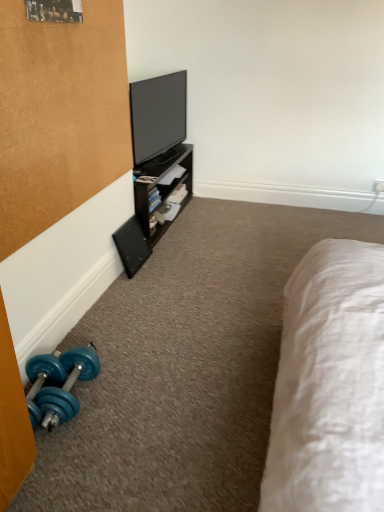
Question: Could you tell me if black matte speaker at lower left is turned towards flat screen tv at upper center?

Choices:
 (A) yes
 (B) no

Answer: (B)

Question: Does black matte speaker at lower left have a lesser width compared to flat screen tv at upper center?

Choices:
 (A) no
 (B) yes

Answer: (B)

Question: Does black matte speaker at lower left have a larger size compared to flat screen tv at upper center?

Choices:
 (A) no
 (B) yes

Answer: (A)

Question: From the image's perspective, is black matte speaker at lower left beneath flat screen tv at upper center?

Choices:
 (A) no
 (B) yes

Answer: (B)

Question: Is black matte speaker at lower left shorter than flat screen tv at upper center?

Choices:
 (A) yes
 (B) no

Answer: (A)

Question: Looking at the image, does blue rubber dumbbell at lower left seem bigger or smaller compared to black matte speaker at lower left?

Choices:
 (A) small
 (B) big

Answer: (B)

Question: In the image, is blue rubber dumbbell at lower left positioned in front of or behind black matte speaker at lower left?

Choices:
 (A) behind
 (B) front

Answer: (B)

Question: Is blue rubber dumbbell at lower left inside or outside of black matte speaker at lower left?

Choices:
 (A) inside
 (B) outside

Answer: (B)

Question: Considering the positions of blue rubber dumbbell at lower left and black matte speaker at lower left in the image, is blue rubber dumbbell at lower left taller or shorter than black matte speaker at lower left?

Choices:
 (A) short
 (B) tall

Answer: (A)

Question: Considering the positions of flat screen tv at upper center and blue rubber dumbbell at lower left in the image, is flat screen tv at upper center wider or thinner than blue rubber dumbbell at lower left?

Choices:
 (A) wide
 (B) thin

Answer: (B)

Question: Which is correct: flat screen tv at upper center is inside blue rubber dumbbell at lower left, or outside of it?

Choices:
 (A) outside
 (B) inside

Answer: (A)

Question: Does point (165, 128) appear closer or farther from the camera than point (38, 395)?

Choices:
 (A) closer
 (B) farther

Answer: (B)

Question: Considering the positions of flat screen tv at upper center and blue rubber dumbbell at lower left in the image, is flat screen tv at upper center bigger or smaller than blue rubber dumbbell at lower left?

Choices:
 (A) big
 (B) small

Answer: (A)

Question: Considering the positions of black matte speaker at lower left and flat screen tv at upper center in the image, is black matte speaker at lower left taller or shorter than flat screen tv at upper center?

Choices:
 (A) short
 (B) tall

Answer: (A)

Question: Is point (117, 239) closer or farther from the camera than point (175, 126)?

Choices:
 (A) farther
 (B) closer

Answer: (B)